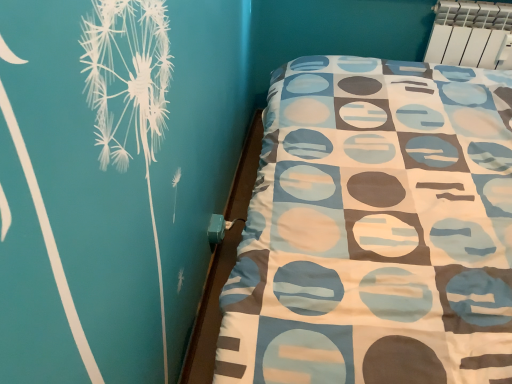
Identify the location of blank space situated above teal plastic bed frame at lower right (from a real-world perspective). The image size is (512, 384). (229, 194).